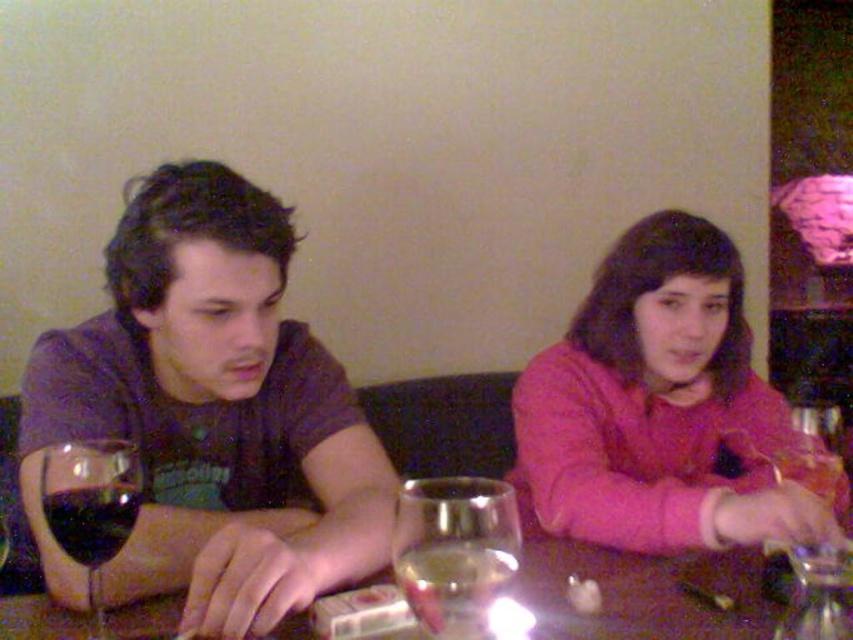
Is the position of translucent glass table at center less distant than that of dark glass at left?

No, translucent glass table at center is behind dark glass at left.

Image resolution: width=853 pixels, height=640 pixels. Find the location of `translucent glass table at center`. translucent glass table at center is located at coordinates (643, 595).

Can you confirm if matte purple shirt at left is positioned to the left of dark glass at left?

No, matte purple shirt at left is not to the left of dark glass at left.

Is matte purple shirt at left above dark glass at left?

Yes, matte purple shirt at left is above dark glass at left.

Who is more forward, [306,576] or [51,506]?

Point [51,506] is in front.

Where is `matte purple shirt at left`? This screenshot has width=853, height=640. matte purple shirt at left is located at coordinates (210, 416).

Does point (514, 541) come behind point (80, 502)?

No, it is not.

At what (x,y) coordinates should I click in order to perform the action: click on clear glass wine glass at center. Please return your answer as a coordinate pair (x, y). Looking at the image, I should click on (456, 550).

In order to click on clear glass wine glass at center in this screenshot , I will do `click(456, 550)`.